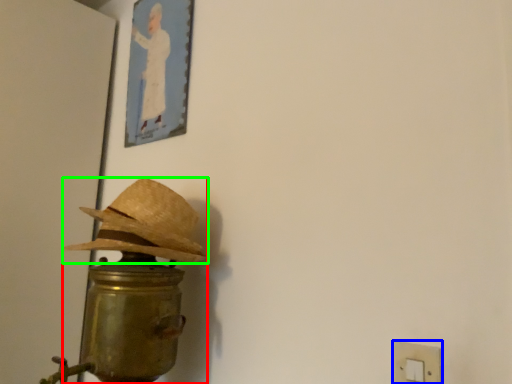
Question: Based on their relative distances, which object is farther from table lamp (highlighted by a red box)? Choose from light switch (highlighted by a blue box) and hat (highlighted by a green box).

Choices:
 (A) light switch
 (B) hat

Answer: (A)